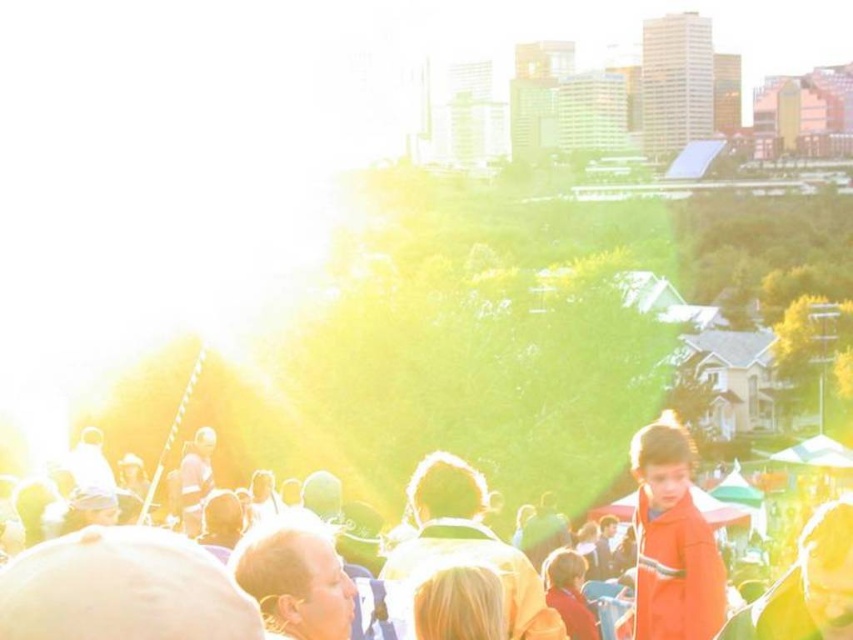
Who is more forward, (850, 577) or (672, 572)?

Point (850, 577)

Who is lower down, orange fabric at center or orange matte coat at lower right?

Positioned lower is orange fabric at center.

Is point (833, 604) positioned in front of point (630, 460)?

Yes, it is.

I want to click on orange fabric at center, so click(x=807, y=586).